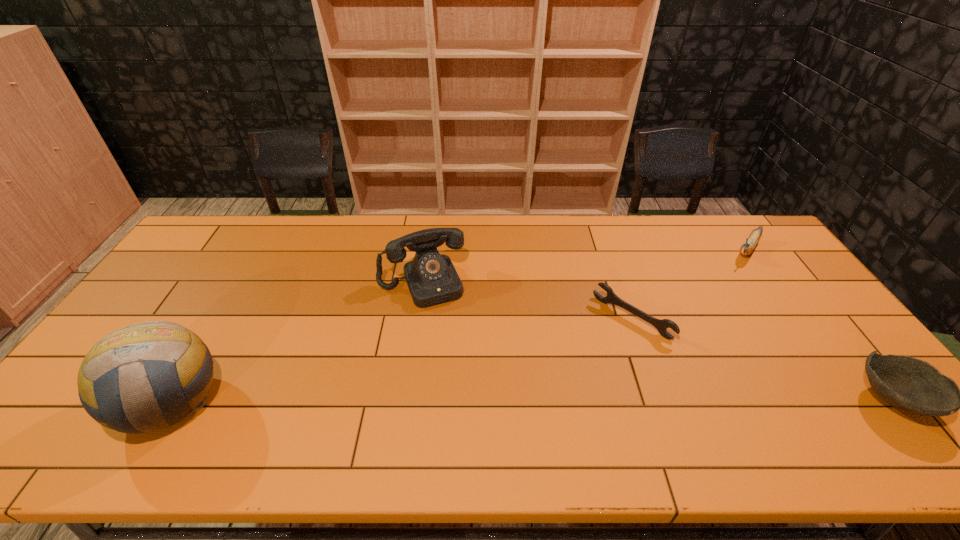
Locate an element on the screen. The height and width of the screenshot is (540, 960). the leftmost object is located at coordinates pos(118,378).

Locate an element on the screen. volleyball is located at coordinates (118, 378).

In order to click on the second shortest object in this screenshot , I will do `click(912, 385)`.

Where is `telephone`? This screenshot has height=540, width=960. telephone is located at coordinates (432, 279).

The width and height of the screenshot is (960, 540). Identify the location of the second object from left to right. (432, 279).

Locate an element on the screen. The height and width of the screenshot is (540, 960). the shortest object is located at coordinates (661, 325).

Find the location of a particular element. The height and width of the screenshot is (540, 960). the third object from right to left is located at coordinates (661, 325).

At what (x,y) coordinates should I click in order to perform the action: click on banana. Please return your answer as a coordinate pair (x, y). Looking at the image, I should click on (749, 245).

I want to click on free point located on the back of the tallest object, so click(220, 319).

At what (x,y) coordinates should I click in order to perform the action: click on vacant space situated on the back of the bowl. Please return your answer as a coordinate pair (x, y). This screenshot has width=960, height=540. Looking at the image, I should click on (802, 284).